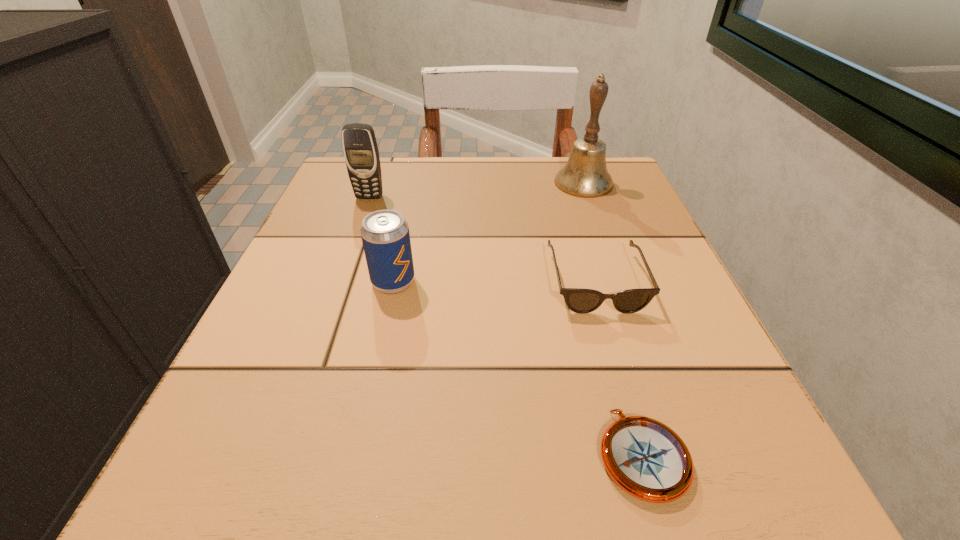
Where is `compass located at the right edge`? This screenshot has width=960, height=540. compass located at the right edge is located at coordinates (644, 457).

Identify the location of object that is at the far left corner. click(360, 149).

Identify the location of object at the far right corner. (585, 174).

Where is `object located at the near right corner`? object located at the near right corner is located at coordinates (644, 457).

The height and width of the screenshot is (540, 960). I want to click on free point at the far edge, so click(555, 178).

I want to click on vacant space at the left edge, so click(345, 279).

Where is `vacant space at the right edge of the desktop`? This screenshot has width=960, height=540. vacant space at the right edge of the desktop is located at coordinates (614, 288).

Find the location of a particular element. vacant space at the near left corner of the desktop is located at coordinates (290, 448).

Locate an element on the screen. The width and height of the screenshot is (960, 540). vacant area at the far right corner is located at coordinates (594, 207).

Locate an element on the screen. The image size is (960, 540). free region at the near right corner of the desktop is located at coordinates (724, 475).